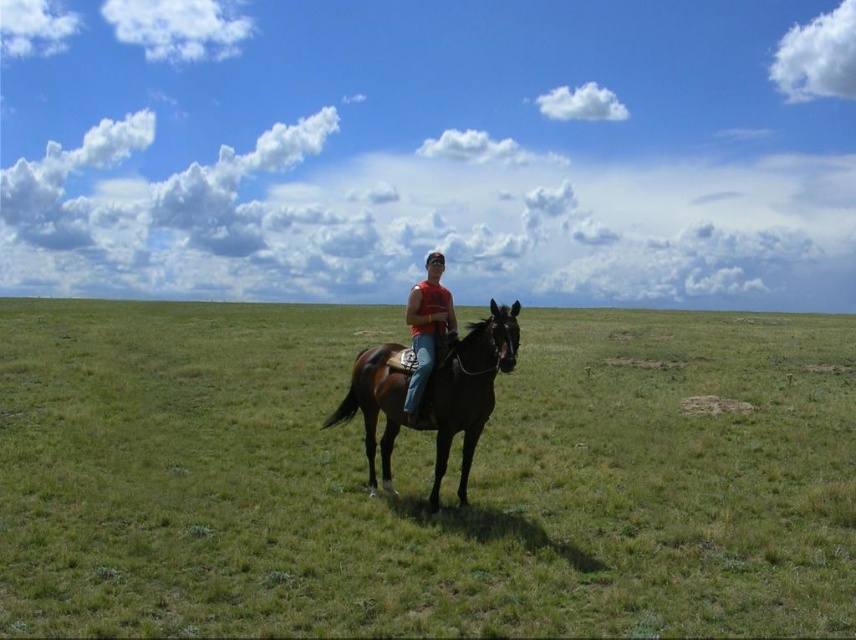
Does green grassy field at center have a lesser height compared to matte red tank top at center?

Yes, green grassy field at center is shorter than matte red tank top at center.

Does point (407, 456) come farther from viewer compared to point (408, 401)?

That is True.

Find the location of `green grassy field at center`. green grassy field at center is located at coordinates (421, 477).

In the scene shown: Is shiny brown horse at center below matte red tank top at center?

Yes, shiny brown horse at center is below matte red tank top at center.

This screenshot has height=640, width=856. What do you see at coordinates (467, 388) in the screenshot?
I see `shiny brown horse at center` at bounding box center [467, 388].

Find the location of a particular element. shiny brown horse at center is located at coordinates (467, 388).

Between point (278, 436) and point (465, 476), which one is positioned behind?

The point (278, 436) is behind.

Can you confirm if green grassy field at center is positioned above shiny brown horse at center?

Yes.

Identify the location of green grassy field at center. (421, 477).

I want to click on green grassy field at center, so click(421, 477).